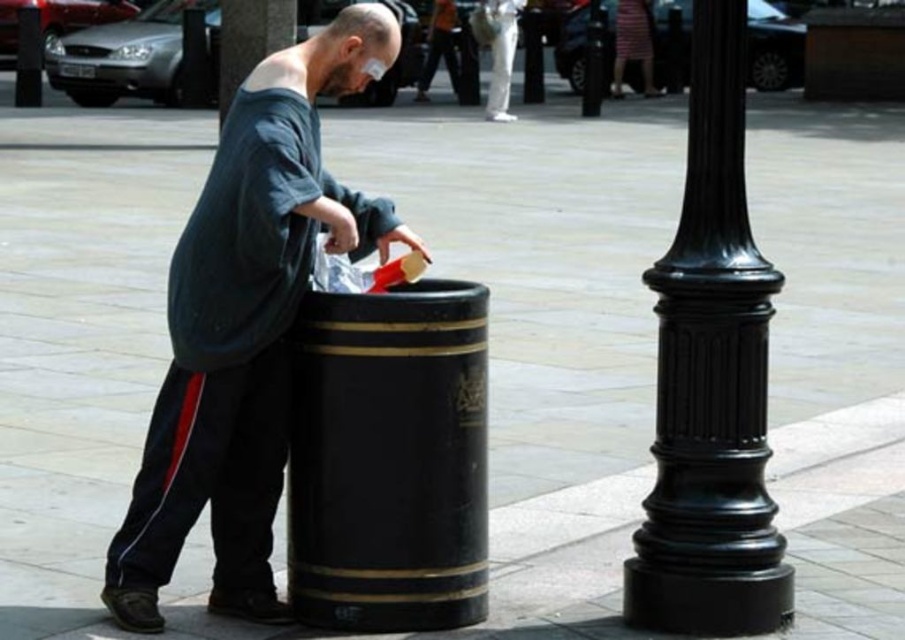
You are a city planner assessing the placement of the black polished barrel at center and the black polished pole at center. Based on their heights, which one would be more suitable for installing a street sign that requires a taller support structure?

The black polished pole at center is taller than the black polished barrel at center, so it would be more suitable for installing a street sign that requires a taller support structure.

You are a delivery person who needs to place a package between the black polished barrel at center and the black polished pole at center. The package requires a space of 50 feet. Can you fit it between them?

The distance between the black polished barrel at center and the black polished pole at center is 49.51 feet, which is slightly less than the required 50 feet. Therefore, the package cannot be placed between them as there isn not enough space.